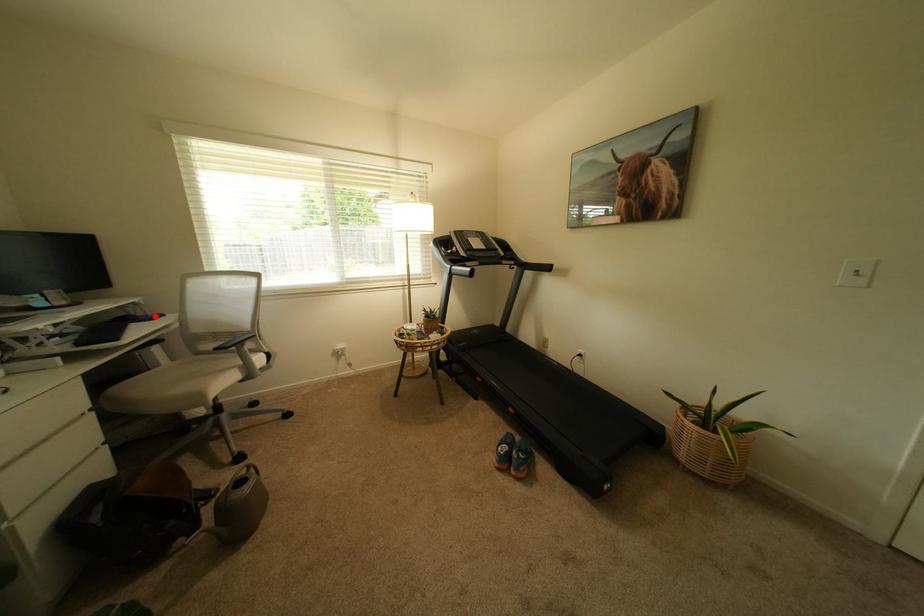
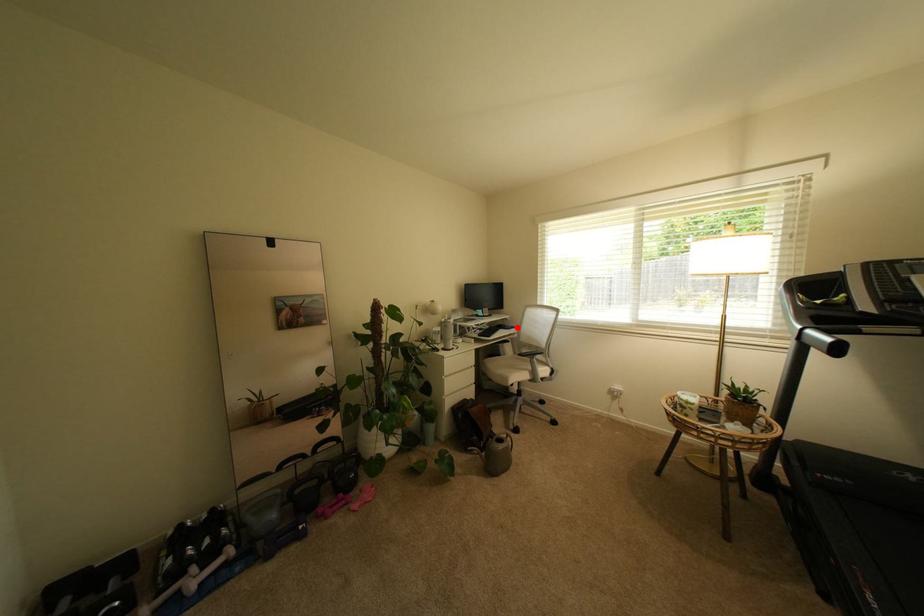
I am providing you with two images of the same scene from different viewpoints. A red point is marked on the first image and another point is marked on the second image. Does the point marked in image1 correspond to the same location as the one in image2?

Yes